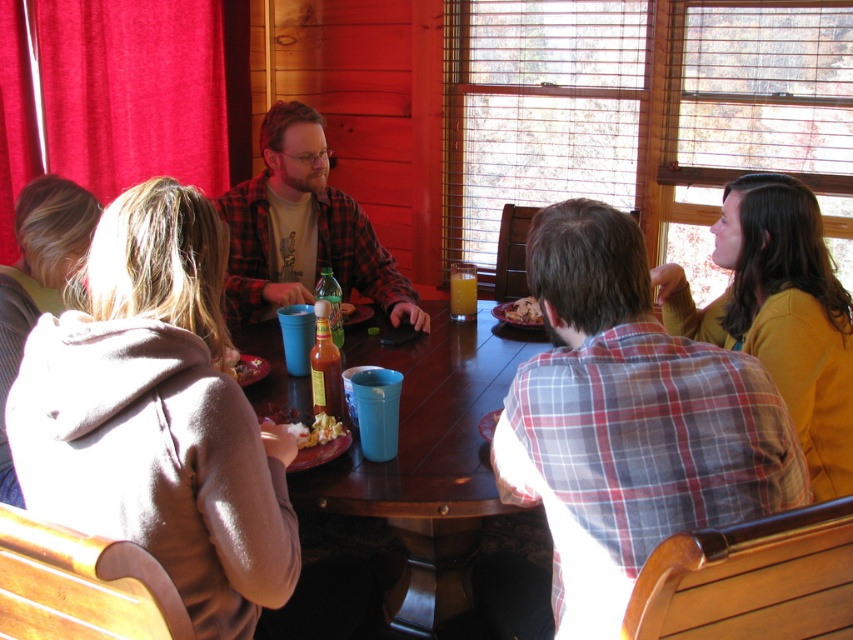
Consider the image. You are a server in a rustic restaurant. You need to place a new order of drinks on the table. The drinks take up 0.5 square feet of space. Can you fit them on the blue plastic table at center without moving the plaid flannel shirt at center?

The blue plastic table at center is larger in size than plaid flannel shirt at center, so there should be enough space to place the drinks without moving the plaid flannel shirt at center.

You are a waiter in a rustic restaurant. You need to place a new order of white crumbly bread at center on the blue plastic table at center. Can you fit it on the table without moving any existing items?

The blue plastic table at center has a larger size compared to white crumbly bread at center, so yes, the bread can be placed on the table without moving existing items.

You are a server in a rustic restaurant. You need to place a new order of white crumbly bread at center on the blue plastic table at center. Is the bread already on the table?

The distance between the blue plastic table at center and the white crumbly bread at center is 40.96 centimeters, which means the bread is not on the table. You should place it there.